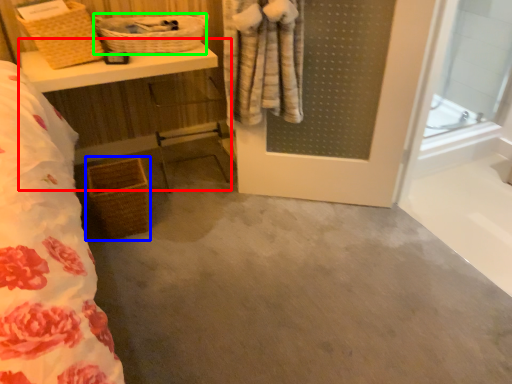
Question: Considering the real-world distances, which object is closest to vanity (highlighted by a red box)? basket (highlighted by a blue box) or basket (highlighted by a green box).

Choices:
 (A) basket
 (B) basket

Answer: (B)